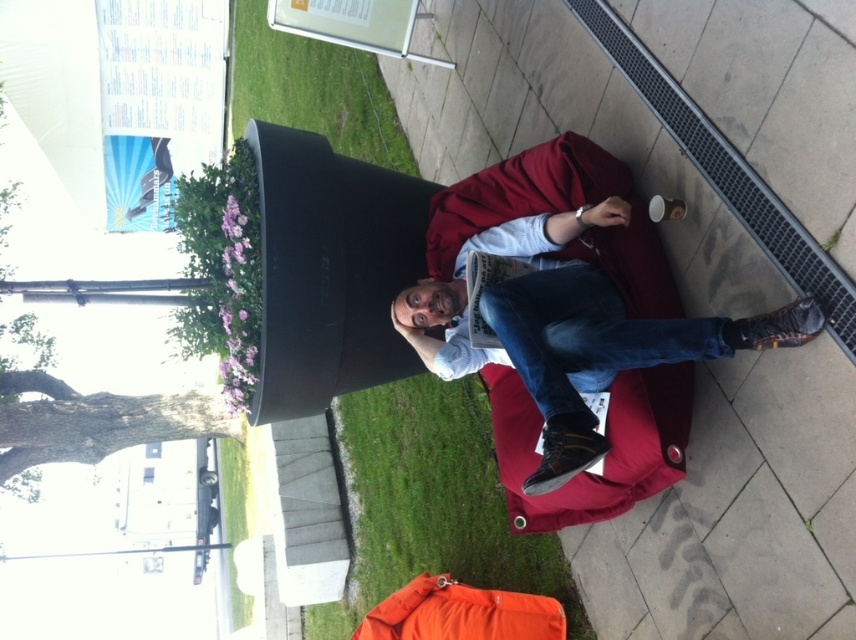
Question: Estimate the real-world distances between objects in this image. Which object is closer to the green grass at upper left?

Choices:
 (A) matte black couch at lower right
 (B) green grass at lower left

Answer: (A)

Question: Which object is the closest to the green grass at upper left?

Choices:
 (A) matte black couch at lower right
 (B) green grass at lower left

Answer: (A)

Question: Considering the relative positions of matte black couch at lower right and green grass at upper left in the image provided, where is matte black couch at lower right located with respect to green grass at upper left?

Choices:
 (A) below
 (B) above

Answer: (A)

Question: Considering the relative positions of green grass at lower left and green grass at upper left in the image provided, where is green grass at lower left located with respect to green grass at upper left?

Choices:
 (A) below
 (B) above

Answer: (A)

Question: Can you confirm if green grass at lower left is positioned above green grass at upper left?

Choices:
 (A) no
 (B) yes

Answer: (A)

Question: Which point appears closest to the camera in this image?

Choices:
 (A) (348, 61)
 (B) (480, 388)
 (C) (559, 305)

Answer: (C)